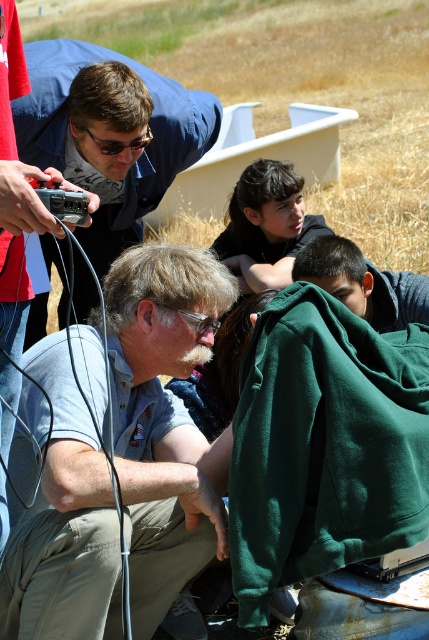
You are standing at the center of the field and want to place a small picnic basket. The basket must be placed exactly at the point labeled as point (323, 445). Where should you place the picnic basket relative to the green fleece blanket at lower right?

The point (323, 445) corresponds to the location of the green fleece blanket at lower right, so you should place the picnic basket directly on top of the green fleece blanket at lower right.

You are a photographer who needs to set up two matte black cameras for a wide shot. The first is the matte black camera at upper left, and the second is the matte black camera at left. Given that the recommended minimum distance between cameras for optimal coverage is 5 feet, will the current spacing between them suffice?

The distance between the matte black camera at upper left and the matte black camera at left is 5.48 feet, which exceeds the recommended minimum of 5 feet. Therefore, the current spacing is sufficient for optimal coverage.